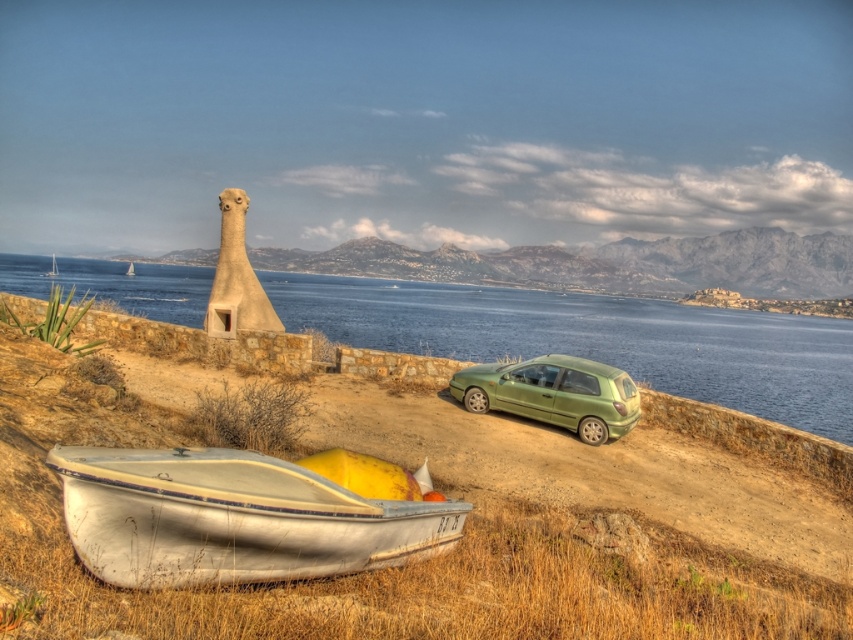
Does blue water at center have a lesser height compared to white painted wood boat at lower left?

In fact, blue water at center may be taller than white painted wood boat at lower left.

Is the position of blue water at center more distant than that of white painted wood boat at lower left?

That is True.

Is point (514, 323) less distant than point (386, 547)?

No.

Locate an element on the screen. blue water at center is located at coordinates (596, 339).

Is green matte hatchback at center closer to the viewer compared to white plastic sailboat at upper left?

Yes, it is.

Between green matte hatchback at center and white plastic sailboat at upper left, which one has less height?

With less height is green matte hatchback at center.

Does point (553, 380) come behind point (53, 269)?

That is False.

Identify the location of green matte hatchback at center. (554, 394).

Measure the distance between point (x=379, y=520) and camera.

Point (x=379, y=520) and camera are 6.98 meters apart.

Where is `white painted wood boat at lower left`? Image resolution: width=853 pixels, height=640 pixels. white painted wood boat at lower left is located at coordinates (233, 518).